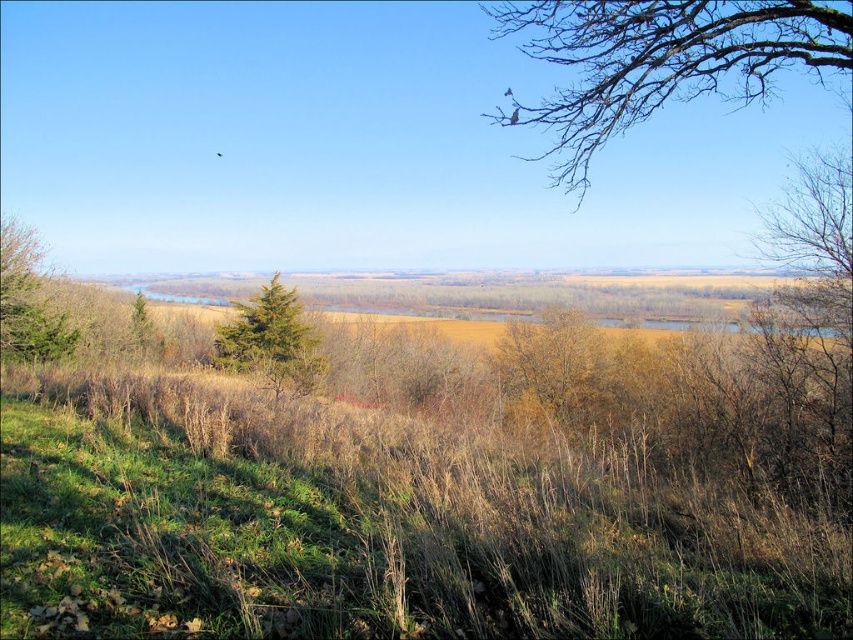
You are a bird looking for a nesting spot. You see the bare branches at upper right and the green matte tree at left. Which tree would you choose if you want to build a nest higher up?

The bare branches at upper right has a greater height compared to the green matte tree at left, so you should choose the bare branches at upper right to build a nest higher up.

You are standing at the center of the image and want to locate the bare branches at upper right. According to the coordinates provided, in which direction should you look to find them?

The bare branches at upper right are located at coordinates point (660, 60), so you should look towards the upper right direction to find them.